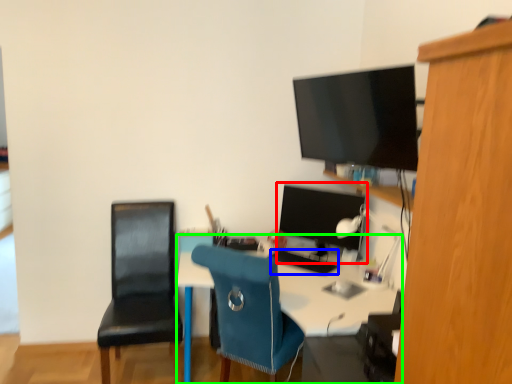
Question: Which object is positioned closest to computer monitor (highlighted by a red box)? Select from keyboard (highlighted by a blue box) and desk (highlighted by a green box).

Choices:
 (A) keyboard
 (B) desk

Answer: (A)